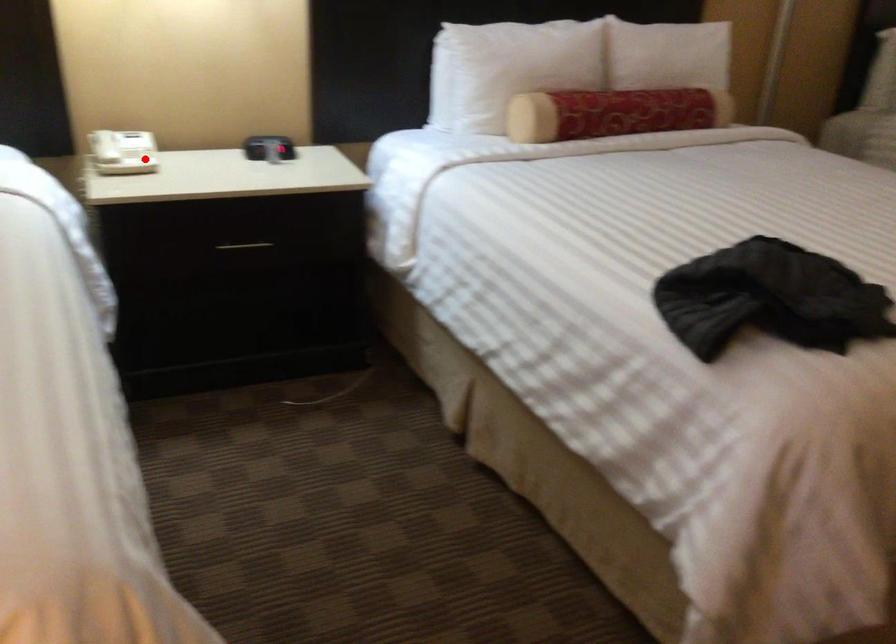
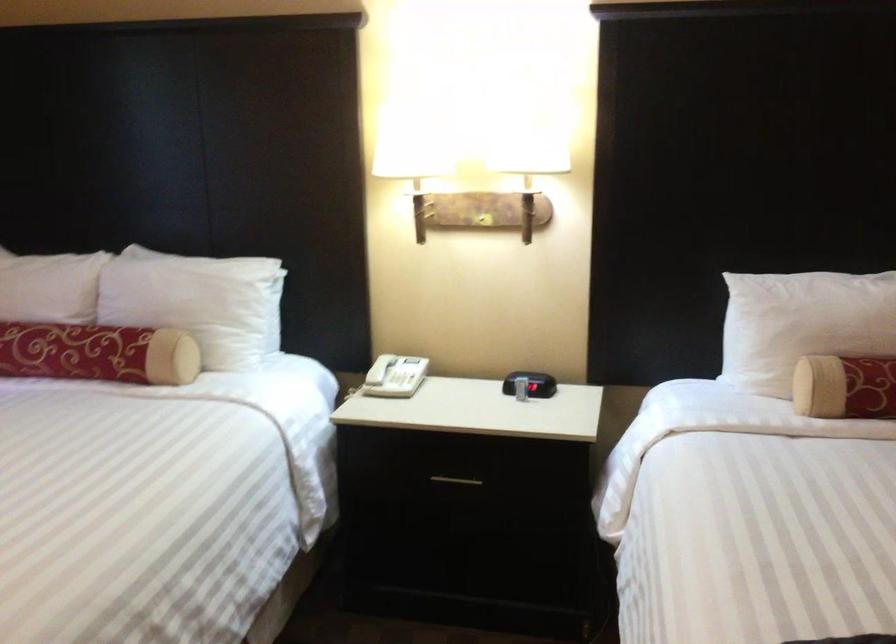
Where in the second image is the point corresponding to the highlighted location from the first image?

(405, 380)